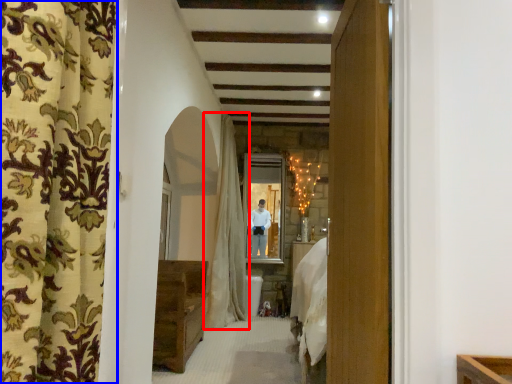
Question: Which of the following is the closest to the observer, curtain (highlighted by a red box) or curtain (highlighted by a blue box)?

Choices:
 (A) curtain
 (B) curtain

Answer: (B)